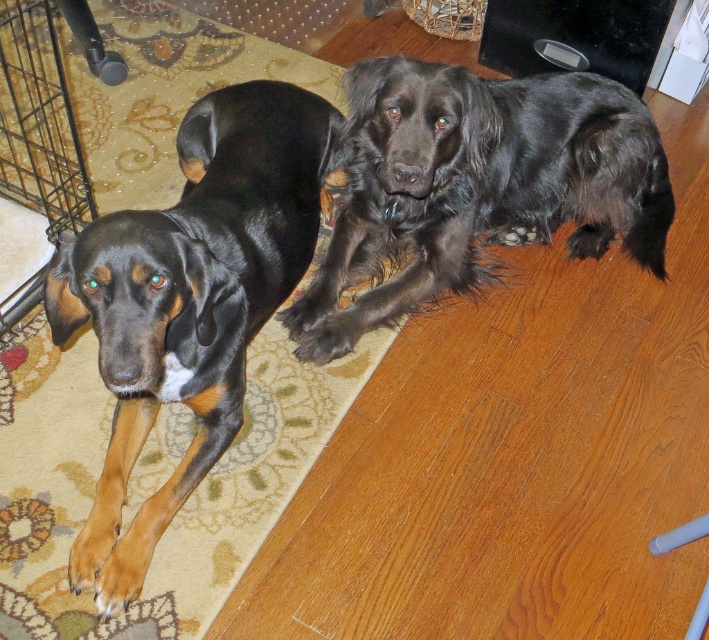
You are a photographer trying to capture a closeup of the black glossy dog at left. The camera you are using has a focus point at coordinate point (189, 300). Will this point help you focus on the black glossy dog at left?

Yes, the point (189, 300) is on the black glossy dog at left, so it will help focus on the dog.

You are a dog trainer who needs to separate two dogs for feeding. The minimum distance required between their feeding areas is 15 inches to prevent any disturbances. Based on the image, can the current distance between the black glossy dog at left and the shiny black dog at upper right accommodate this requirement?

The black glossy dog at left is 14.38 inches away from the shiny black dog at upper right. Since the required minimum distance is 15 inches, the current distance is insufficient to meet the requirement.

You are a photographer trying to capture both dogs in a single shot. You notice two points marked in the image. The first point is at coordinates point (318,189), and the second is at point (423,109). Which of these two points is closer to the camera?

Point (318,189) is further to the viewer than point (423,109), so the second point at point (423,109) is closer to the camera.